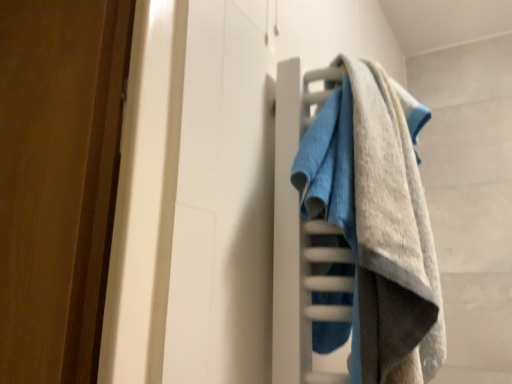
This screenshot has height=384, width=512. What do you see at coordinates (377, 217) in the screenshot?
I see `textured cotton towel at center` at bounding box center [377, 217].

What are the coordinates of `textured cotton towel at center` in the screenshot? It's located at (377, 217).

Find the location of a particular element. This screenshot has height=384, width=512. textured cotton towel at center is located at coordinates (377, 217).